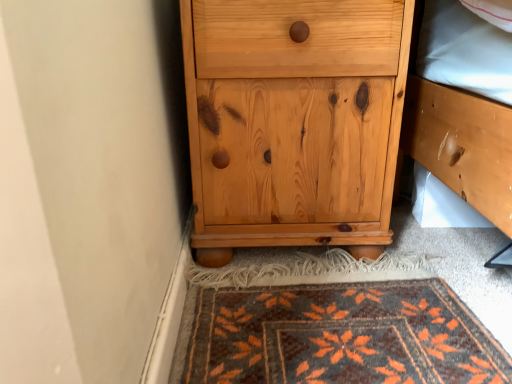
The image size is (512, 384). I want to click on free space above dark brown woven rug at lower center (from a real-world perspective), so click(326, 312).